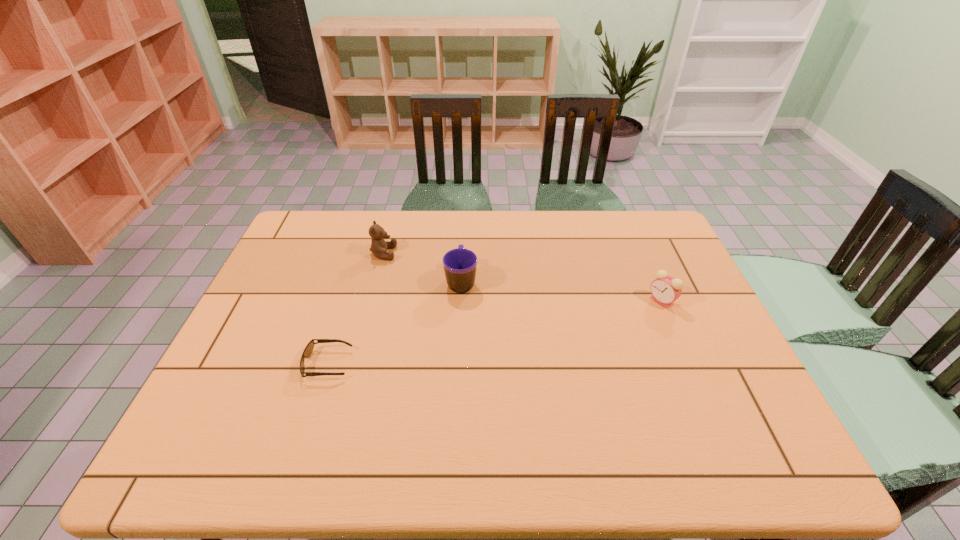
Find the location of a particular element. teddy bear is located at coordinates (379, 246).

You are a GUI agent. You are given a task and a screenshot of the screen. Output one action in this format:
    pyautogui.click(x=<x>, y=<y>)
    Task: Click on the third object from left to right
    This screenshot has height=540, width=960.
    Given the screenshot: What is the action you would take?
    pyautogui.click(x=459, y=264)

Where is `the rightmost object`? the rightmost object is located at coordinates (665, 289).

The height and width of the screenshot is (540, 960). I want to click on sunglasses, so click(308, 350).

Identify the location of the nearest object. Image resolution: width=960 pixels, height=540 pixels. (308, 350).

Locate an element on the screen. vacant region located on the front-facing side of the teddy bear is located at coordinates (476, 253).

What are the coordinates of `vacant area situated with the handle on the side of the mug` in the screenshot? It's located at (463, 250).

Find the location of a particular element. This screenshot has height=540, width=960. vacant space situated with the handle on the side of the mug is located at coordinates (464, 235).

Locate an element on the screen. free point located with the handle on the side of the mug is located at coordinates (463, 254).

What are the coordinates of `vacant space located on the face of the alarm clock` in the screenshot? It's located at [559, 301].